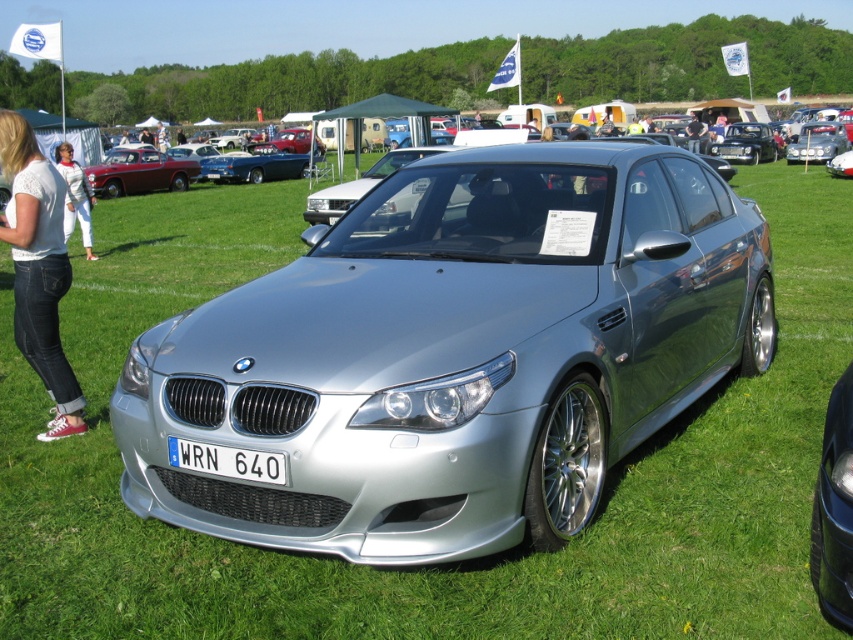
Is point (838, 536) more distant than point (265, 456)?

No, (838, 536) is closer to viewer.

Is point (822, 492) positioned in front of point (262, 472)?

Yes, point (822, 492) is in front of point (262, 472).

What do you see at coordinates (834, 509) in the screenshot? I see `silver metallic car at center` at bounding box center [834, 509].

The width and height of the screenshot is (853, 640). I want to click on silver metallic car at center, so click(x=834, y=509).

Describe the element at coordinates (38, 268) in the screenshot. I see `denim jeans at lower left` at that location.

Is denim jeans at lower left positioned behind white plastic license plate at center?

That is True.

The image size is (853, 640). In order to click on denim jeans at lower left in this screenshot , I will do `click(38, 268)`.

Which of these two, shiny maroon sedan at left or white plastic license plate at center, stands taller?

shiny maroon sedan at left

Between point (142, 160) and point (228, 448), which one is positioned in front?

Positioned in front is point (228, 448).

Is point (163, 161) farther from viewer compared to point (186, 452)?

That is True.

Locate an element on the screen. The width and height of the screenshot is (853, 640). shiny maroon sedan at left is located at coordinates pos(138,172).